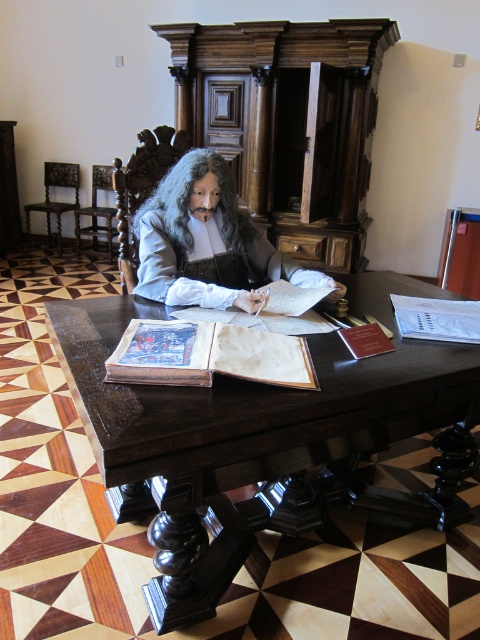
You are an art student analyzing the composition of this historical scene. You notice a point marked at coordinates (x=436, y=317). Based on the scene description, can you determine what object this point is located on?

The point at coordinates (x=436, y=317) is located on the white paper book at center.

You are a museum visitor who wants to take a photo of the white paper book at center without the smooth gray wig at center appearing in the shot. Is this possible given their positions?

The smooth gray wig at center is above the white paper book at center, so it would block the view of the book. Therefore, you cannot take a photo of the white paper book at center without the smooth gray wig at center appearing in the shot.